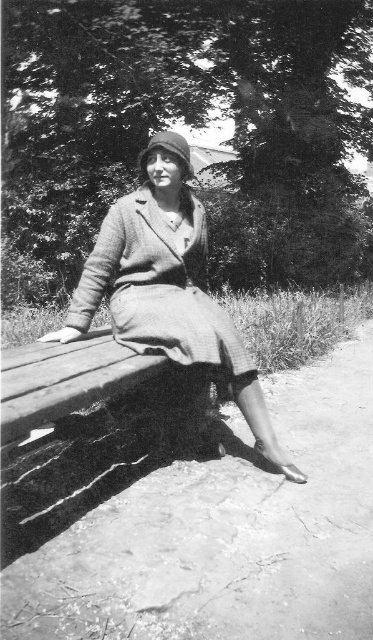
Which is above, textured wool dress at center or matte brown hat at upper center?

matte brown hat at upper center is above.

Looking at this image, who is more forward, [195,348] or [165,141]?

Positioned in front is point [195,348].

Find the location of a particular element. The height and width of the screenshot is (640, 373). textured wool dress at center is located at coordinates (158, 288).

Is point (229, 365) closer to camera compared to point (145, 164)?

Yes, point (229, 365) is in front of point (145, 164).

Can you confirm if coarse woolen coat at center is thinner than matte brown hat at upper center?

Yes, coarse woolen coat at center is thinner than matte brown hat at upper center.

Who is more distant from viewer, (256, 440) or (139, 164)?

The point (139, 164) is behind.

Image resolution: width=373 pixels, height=640 pixels. What are the coordinates of `coarse woolen coat at center` in the screenshot? It's located at (167, 292).

Does coarse woolen coat at center have a lesser height compared to textured wool dress at center?

In fact, coarse woolen coat at center may be taller than textured wool dress at center.

How distant is coarse woolen coat at center from textured wool dress at center?

A distance of 2.69 inches exists between coarse woolen coat at center and textured wool dress at center.

You are a GUI agent. You are given a task and a screenshot of the screen. Output one action in this format:
    pyautogui.click(x=<x>, y=<y>)
    Task: Click on the coarse woolen coat at center
    Image resolution: width=373 pixels, height=640 pixels.
    Given the screenshot: What is the action you would take?
    pyautogui.click(x=167, y=292)